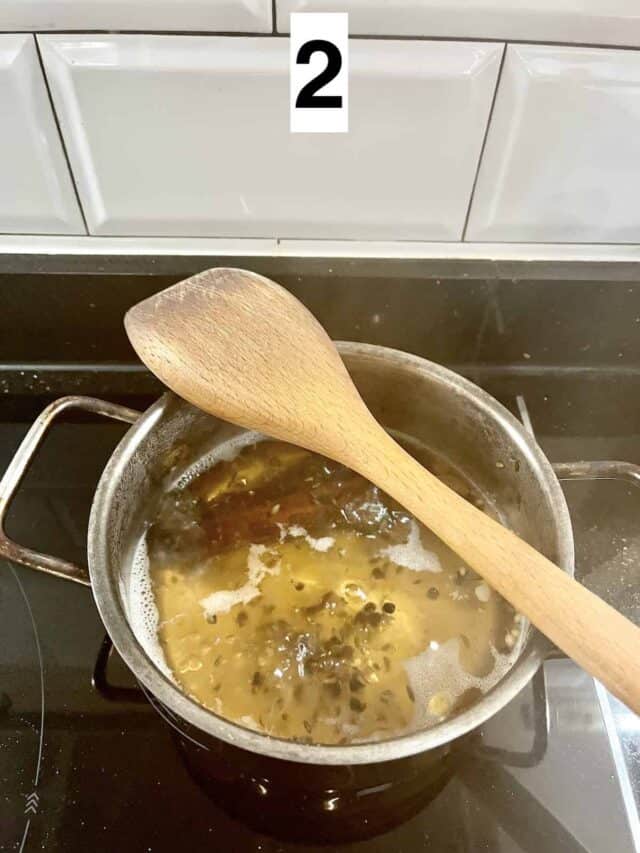
Identify the location of wooden spoon. The image size is (640, 853). (429, 485).